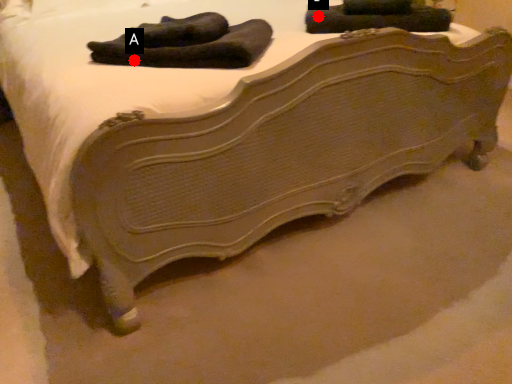
Question: Two points are circled on the image, labeled by A and B beside each circle. Which point is farther from the camera taking this photo?

Choices:
 (A) A is further
 (B) B is further

Answer: (B)